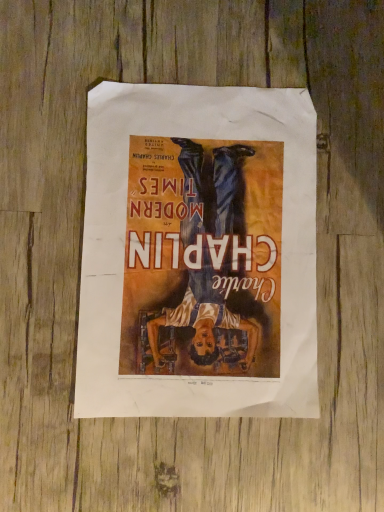
Find the location of a particular element. This screenshot has width=384, height=512. free space above matte paper poster at center (from a real-world perspective) is located at coordinates (197, 251).